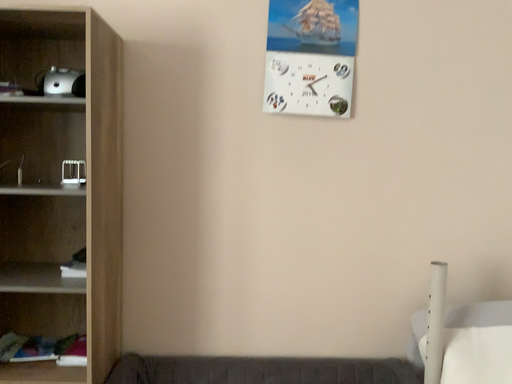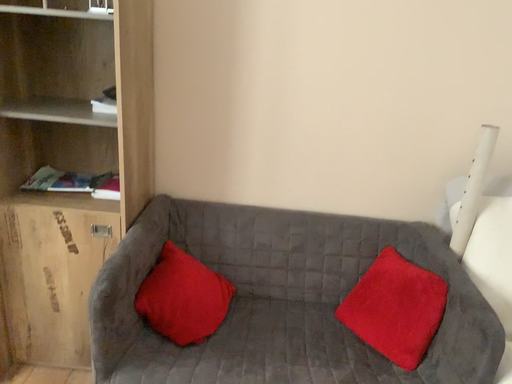
Question: Which way did the camera rotate in the video?

Choices:
 (A) rotated downward
 (B) rotated upward

Answer: (A)